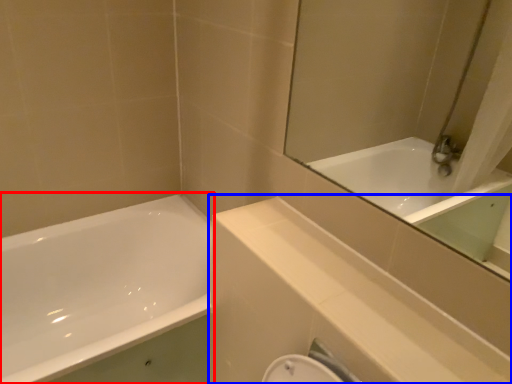
Question: Which object appears farthest to the camera in this image, bathtub (highlighted by a red box) or balustrade (highlighted by a blue box)?

Choices:
 (A) bathtub
 (B) balustrade

Answer: (A)